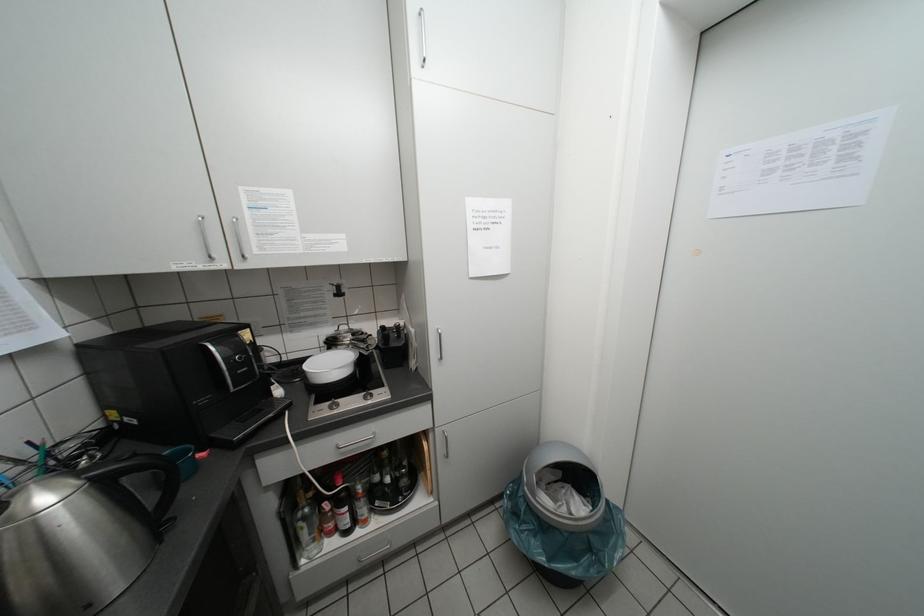
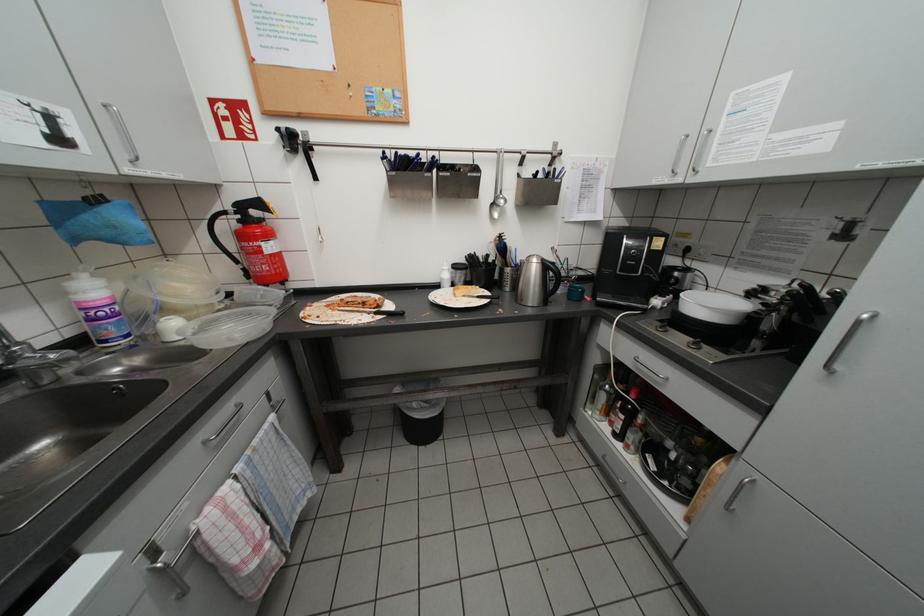
In the scene shown: Based on the continuous images, in which direction is the camera rotating?

The rotation direction of the camera is left-down.